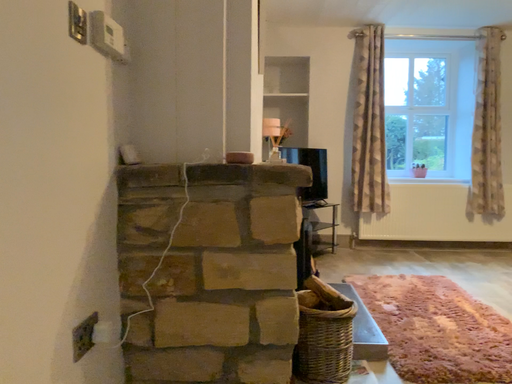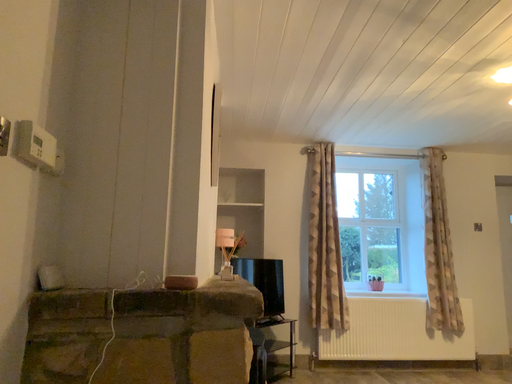
Question: How did the camera likely rotate when shooting the video?

Choices:
 (A) rotated upward
 (B) rotated downward

Answer: (A)